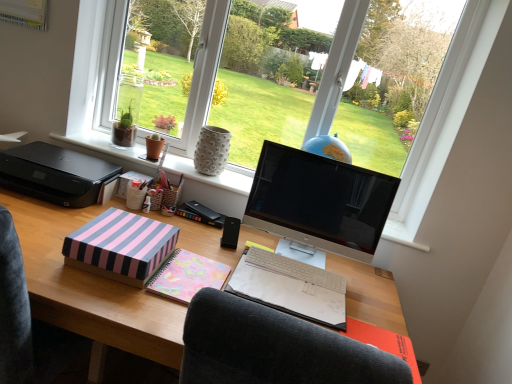
Find the location of a particular element. This screenshot has height=384, width=512. free point behind pastel floral notebook at center is located at coordinates (296, 253).